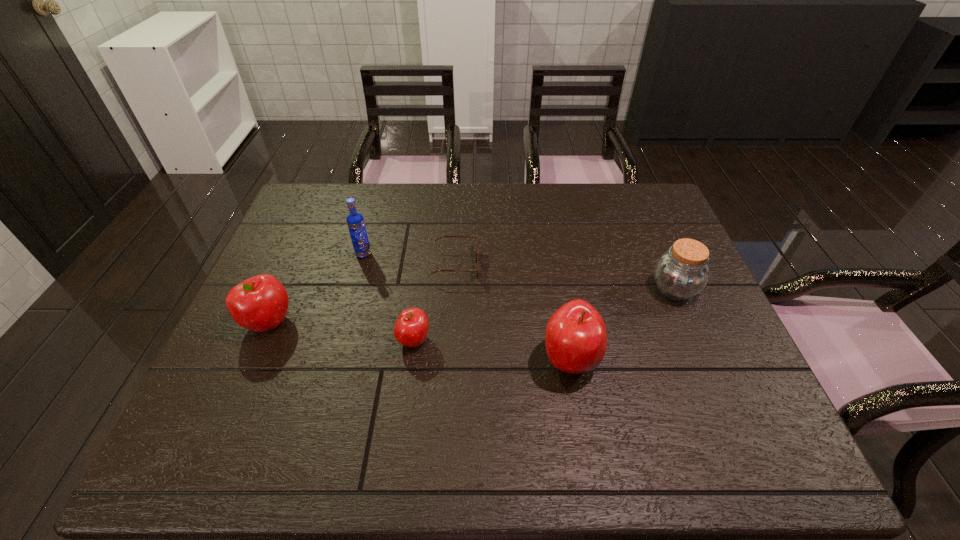
Locate an element on the screen. This screenshot has height=540, width=960. vacant space in between the second shortest apple and the fifth tallest object is located at coordinates (341, 332).

Where is `vacant space in between the vodka and the jar`? This screenshot has width=960, height=540. vacant space in between the vodka and the jar is located at coordinates (518, 272).

The image size is (960, 540). I want to click on the second closest object relative to the rightmost object, so click(442, 236).

Find the location of `the fourth closest object to the spectacles`. the fourth closest object to the spectacles is located at coordinates (260, 303).

Locate an element on the screen. apple that is the nearest to the rightmost object is located at coordinates (575, 338).

What are the coordinates of `apple that stands as the second closest to the vodka` in the screenshot? It's located at tap(411, 328).

At what (x,y) coordinates should I click in order to perform the action: click on free region that satisfies the following two spatial constraints: 1. at the front view of the rightmost apple; 2. on the right side of the spectacles. Please return your answer as a coordinate pair (x, y). Looking at the image, I should click on (451, 360).

This screenshot has height=540, width=960. In order to click on vacant space that satisfies the following two spatial constraints: 1. at the front view of the spectacles; 2. on the front side of the fifth tallest object in this screenshot , I will do `click(452, 340)`.

I want to click on blank space that satisfies the following two spatial constraints: 1. at the front view of the rightmost object; 2. on the left side of the spectacles, so click(x=455, y=289).

This screenshot has height=540, width=960. Find the location of `free spot that satisfies the following two spatial constraints: 1. at the front view of the shortest object; 2. on the right side of the jar`. free spot that satisfies the following two spatial constraints: 1. at the front view of the shortest object; 2. on the right side of the jar is located at coordinates (455, 289).